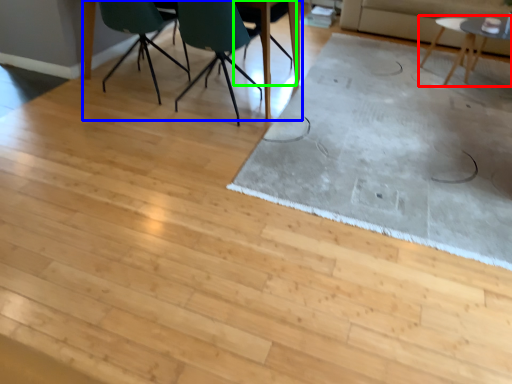
Question: Based on their relative distances, which object is nearer to table (highlighted by a red box)? Choose from table (highlighted by a blue box) and chair (highlighted by a green box).

Choices:
 (A) table
 (B) chair

Answer: (B)